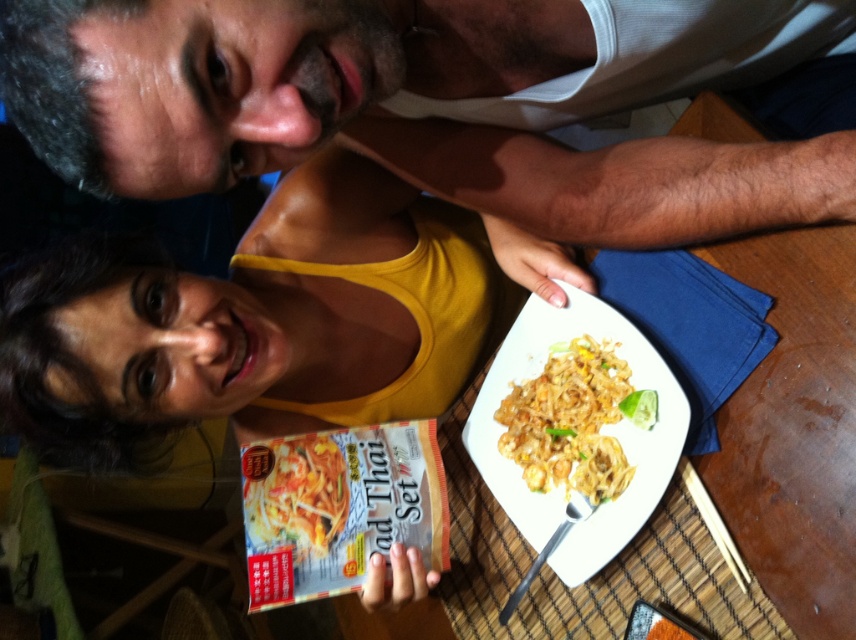
Which is more to the left, white tank top at upper center or yellow matte pad thai set at center?

Positioned to the left is yellow matte pad thai set at center.

Does white tank top at upper center have a greater height compared to yellow matte pad thai set at center?

Correct, white tank top at upper center is much taller as yellow matte pad thai set at center.

Describe the element at coordinates (414, 106) in the screenshot. I see `white tank top at upper center` at that location.

At what (x,y) coordinates should I click in order to perform the action: click on white tank top at upper center. Please return your answer as a coordinate pair (x, y). Looking at the image, I should click on (414, 106).

Can you confirm if yellowish matte noodles at center is positioned to the left of yellow matte pad thai set at center?

Incorrect, yellowish matte noodles at center is not on the left side of yellow matte pad thai set at center.

Does point (528, 468) come behind point (288, 513)?

Yes, point (528, 468) is behind point (288, 513).

Where is `yellowish matte noodles at center`? This screenshot has height=640, width=856. yellowish matte noodles at center is located at coordinates [574, 420].

Which is above, white tank top at upper center or shiny white plate at center?

white tank top at upper center is higher up.

Can you confirm if white tank top at upper center is wider than shiny white plate at center?

Correct, the width of white tank top at upper center exceeds that of shiny white plate at center.

Is point (290, 38) closer to camera compared to point (486, 461)?

Yes, point (290, 38) is closer to viewer.

The height and width of the screenshot is (640, 856). I want to click on white tank top at upper center, so click(x=414, y=106).